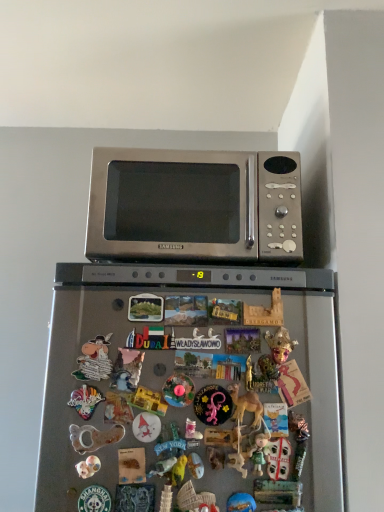
Question: Considering the positions of matte plastic toy at center, marked as the 9th toy in a right-to-left arrangement, and blue rubber toy at center, which is counted as the 8th toy, starting from the left, in the image, is matte plastic toy at center, marked as the 9th toy in a right-to-left arrangement, taller or shorter than blue rubber toy at center, which is counted as the 8th toy, starting from the left,?

Choices:
 (A) short
 (B) tall

Answer: (B)

Question: Looking at the image, does matte plastic toy at center, marked as the 9th toy in a right-to-left arrangement, seem bigger or smaller compared to blue rubber toy at center, arranged as the fourth toy when viewed from the right?

Choices:
 (A) small
 (B) big

Answer: (B)

Question: Which object is positioned farthest from the matte plastic toy at center, which ranks as the 2th toy in right-to-left order?

Choices:
 (A) matte plastic toy at center, arranged as the 3th toy when viewed from the left
 (B) clear plastic toy at lower left, the eighth toy in the right-to-left sequence
 (C) satin silver microwave at upper center
 (D) matte green figurine at lower center, placed as the third toy when sorted from right to left
 (E) porcelain figurine at lower left, which appears as the second toy when viewed from the left

Answer: (C)

Question: Considering the real-world distances, which object is closest to the porcelain figurine at lower left, which appears as the second toy when viewed from the left?

Choices:
 (A) pink rubber toy at center, the fifth toy viewed from the right
 (B) metallic silver unicorn at center, which is the fifth toy in left-to-right order
 (C) blue rubber toy at center, arranged as the fourth toy when viewed from the right
 (D) metallic gold camel at center
 (E) satin silver microwave at upper center

Answer: (B)